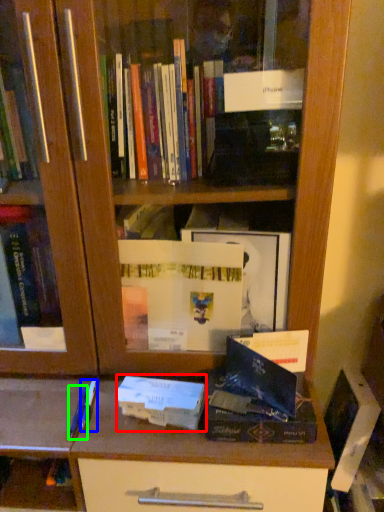
Question: Considering the real-world distances, which object is closest to paperback book (highlighted by a red box)? pen (highlighted by a blue box) or pen (highlighted by a green box).

Choices:
 (A) pen
 (B) pen

Answer: (A)